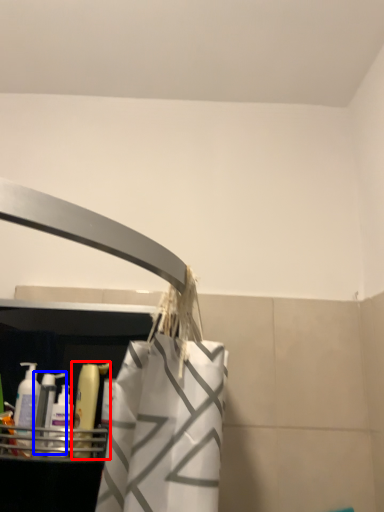
Question: Among these objects, which one is farthest to the camera, cleaning product (highlighted by a red box) or cleaning product (highlighted by a blue box)?

Choices:
 (A) cleaning product
 (B) cleaning product

Answer: (A)